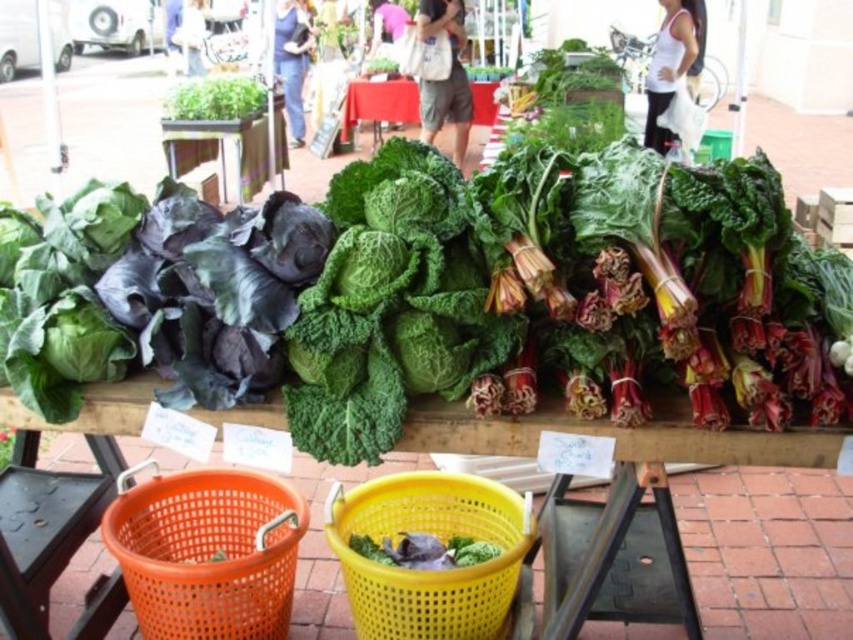
Question: Is wooden table at center wider than green leafy vegetable at center?

Choices:
 (A) yes
 (B) no

Answer: (A)

Question: Does yellow plastic basket at lower center have a greater width compared to wooden table at center?

Choices:
 (A) no
 (B) yes

Answer: (A)

Question: Can you confirm if orange plastic basket at lower left is wider than yellow plastic basket at lower center?

Choices:
 (A) no
 (B) yes

Answer: (A)

Question: Which is nearer to the yellow plastic basket at lower center?

Choices:
 (A) green leafy vegetable at center
 (B) wooden table at center
 (C) orange plastic basket at lower left
 (D) green leafy vegetables at center

Answer: (A)

Question: Which point is farther to the camera?

Choices:
 (A) yellow plastic basket at lower center
 (B) green leafy vegetables at center
 (C) wooden table at center

Answer: (B)

Question: Which of the following is the closest to the observer?

Choices:
 (A) (119, 486)
 (B) (419, 497)
 (C) (473, 88)
 (D) (775, 449)

Answer: (D)